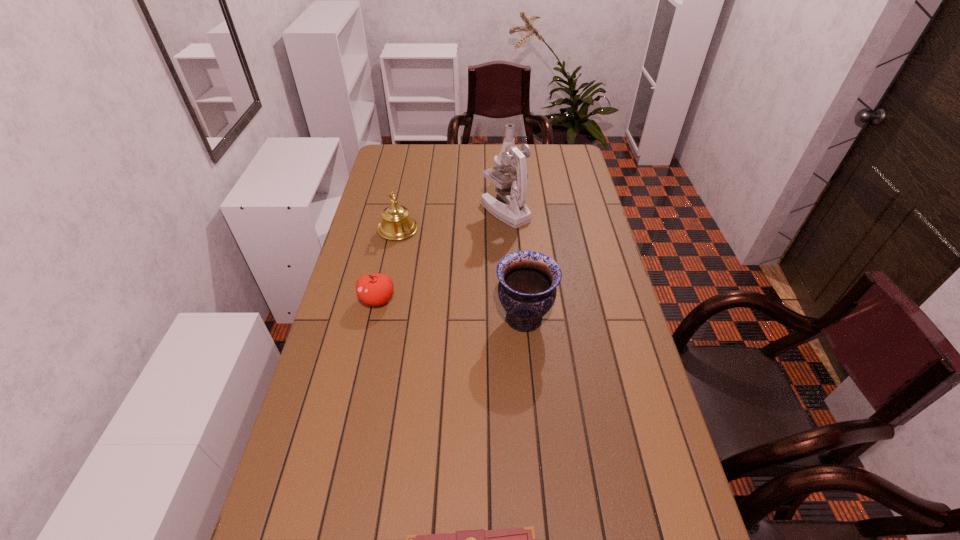
Identify the location of bell that is at the left edge. This screenshot has height=540, width=960. (396, 224).

You are a GUI agent. You are given a task and a screenshot of the screen. Output one action in this format:
    pyautogui.click(x=<x>, y=<y>)
    Task: Click on the apple positioned at the left edge
    The height and width of the screenshot is (540, 960).
    Given the screenshot: What is the action you would take?
    pyautogui.click(x=376, y=289)

Where is `vacant space at the far edge of the desktop`? This screenshot has height=540, width=960. vacant space at the far edge of the desktop is located at coordinates (456, 156).

The image size is (960, 540). In the image, there is a desktop. In order to click on vacant region at the left edge in this screenshot , I will do `click(320, 390)`.

The height and width of the screenshot is (540, 960). I want to click on free spot at the right edge of the desktop, so click(x=585, y=248).

Locate an element on the screen. This screenshot has height=540, width=960. vacant space at the far right corner is located at coordinates (554, 160).

In order to click on vacant space that's between the second tallest object and the bell in this screenshot , I will do `click(461, 274)`.

The image size is (960, 540). I want to click on blank region between the apple and the tallest object, so click(442, 255).

Find the location of a particular element. Image resolution: width=960 pixels, height=540 pixels. empty location between the third shortest object and the fourth tallest object is located at coordinates (388, 265).

The height and width of the screenshot is (540, 960). I want to click on unoccupied position between the fourth tallest object and the microscope, so click(442, 255).